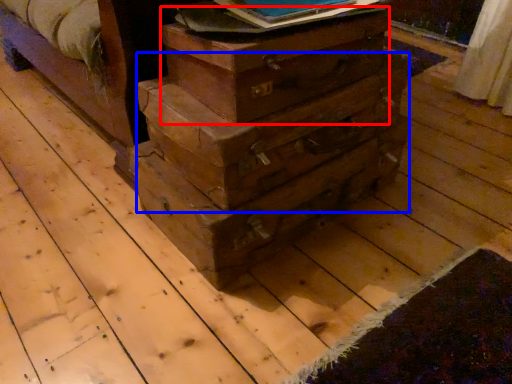
Question: Which object is further to the camera taking this photo, crate (highlighted by a red box) or drawer (highlighted by a blue box)?

Choices:
 (A) crate
 (B) drawer

Answer: (B)